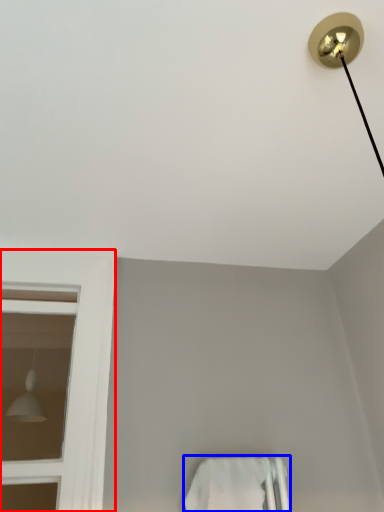
Question: Which object appears farthest to the camera in this image, bay window (highlighted by a red box) or towel bar (highlighted by a blue box)?

Choices:
 (A) bay window
 (B) towel bar

Answer: (A)